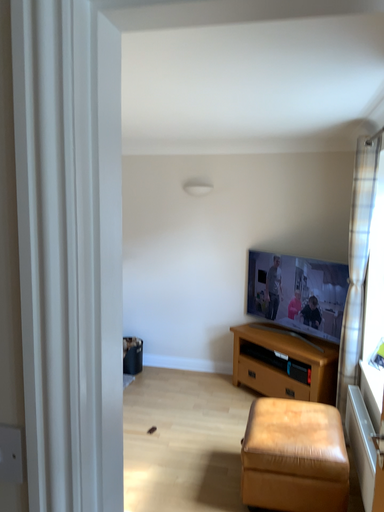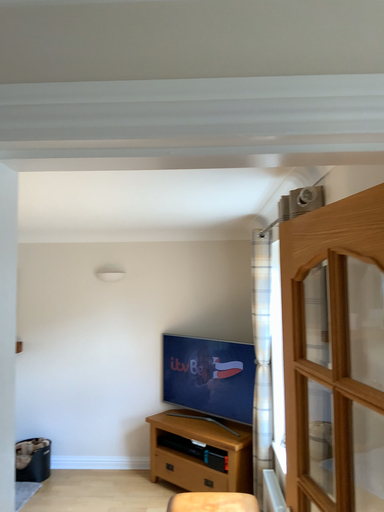
Question: How did the camera likely rotate when shooting the video?

Choices:
 (A) rotated downward
 (B) rotated upward

Answer: (B)